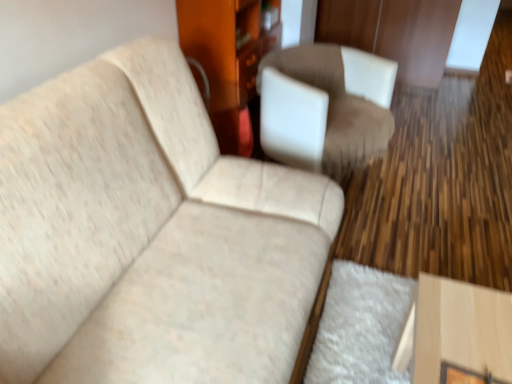
Question: Should I look upward or downward to see beige fabric couch at upper left?

Choices:
 (A) up
 (B) down

Answer: (B)

Question: Is the depth of beige fabric couch at upper left less than that of wooden dresser at center?

Choices:
 (A) no
 (B) yes

Answer: (B)

Question: Is beige fabric couch at upper left taller than wooden dresser at center?

Choices:
 (A) yes
 (B) no

Answer: (B)

Question: Is beige fabric couch at upper left not within wooden dresser at center?

Choices:
 (A) yes
 (B) no

Answer: (A)

Question: From the image's perspective, would you say beige fabric couch at upper left is shown under wooden dresser at center?

Choices:
 (A) yes
 (B) no

Answer: (A)

Question: Can you confirm if beige fabric couch at upper left is positioned to the left of wooden dresser at center?

Choices:
 (A) no
 (B) yes

Answer: (B)

Question: Considering the relative sizes of beige fabric couch at upper left and wooden dresser at center in the image provided, is beige fabric couch at upper left thinner than wooden dresser at center?

Choices:
 (A) no
 (B) yes

Answer: (A)

Question: Is suede-like brown chair at center positioned far away from wooden dresser at center?

Choices:
 (A) no
 (B) yes

Answer: (A)

Question: Is suede-like brown chair at center aimed at wooden dresser at center?

Choices:
 (A) yes
 (B) no

Answer: (B)

Question: Is wooden dresser at center surrounded by suede-like brown chair at center?

Choices:
 (A) no
 (B) yes

Answer: (A)

Question: Can you confirm if suede-like brown chair at center is wider than wooden dresser at center?

Choices:
 (A) no
 (B) yes

Answer: (B)

Question: From the image's perspective, is suede-like brown chair at center beneath wooden dresser at center?

Choices:
 (A) no
 (B) yes

Answer: (B)

Question: From a real-world perspective, is suede-like brown chair at center located beneath wooden dresser at center?

Choices:
 (A) no
 (B) yes

Answer: (B)

Question: Can we say wooden dresser at center lies outside beige fabric couch at upper left?

Choices:
 (A) no
 (B) yes

Answer: (B)